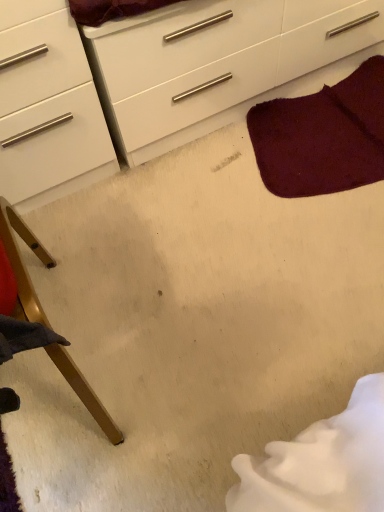
Question: From the image's perspective, would you say wooden chair leg at lower left is shown under white glossy chest of drawers at upper center?

Choices:
 (A) yes
 (B) no

Answer: (A)

Question: Is wooden chair leg at lower left oriented towards white glossy chest of drawers at upper center?

Choices:
 (A) no
 (B) yes

Answer: (A)

Question: Is wooden chair leg at lower left beside white glossy chest of drawers at upper center?

Choices:
 (A) yes
 (B) no

Answer: (B)

Question: Does wooden chair leg at lower left have a lesser width compared to white glossy chest of drawers at upper center?

Choices:
 (A) no
 (B) yes

Answer: (A)

Question: Considering the relative sizes of wooden chair leg at lower left and white glossy chest of drawers at upper center in the image provided, is wooden chair leg at lower left taller than white glossy chest of drawers at upper center?

Choices:
 (A) no
 (B) yes

Answer: (B)

Question: Choose the correct answer: Is white glossy chest of drawers at upper center inside wooden chair leg at lower left or outside it?

Choices:
 (A) outside
 (B) inside

Answer: (A)

Question: Is white glossy chest of drawers at upper center taller or shorter than wooden chair leg at lower left?

Choices:
 (A) tall
 (B) short

Answer: (B)

Question: Is white glossy chest of drawers at upper center wider or thinner than wooden chair leg at lower left?

Choices:
 (A) wide
 (B) thin

Answer: (B)

Question: From the image's perspective, is white glossy chest of drawers at upper center positioned above or below wooden chair leg at lower left?

Choices:
 (A) above
 (B) below

Answer: (A)

Question: In terms of size, does burgundy plush rug at upper right appear bigger or smaller than wooden chair leg at lower left?

Choices:
 (A) small
 (B) big

Answer: (A)

Question: Do you think burgundy plush rug at upper right is within wooden chair leg at lower left, or outside of it?

Choices:
 (A) inside
 (B) outside

Answer: (B)

Question: From a real-world perspective, is burgundy plush rug at upper right above or below wooden chair leg at lower left?

Choices:
 (A) above
 (B) below

Answer: (B)

Question: Is burgundy plush rug at upper right taller or shorter than wooden chair leg at lower left?

Choices:
 (A) tall
 (B) short

Answer: (B)

Question: From their relative heights in the image, would you say white glossy chest of drawers at upper center is taller or shorter than burgundy plush rug at upper right?

Choices:
 (A) tall
 (B) short

Answer: (A)

Question: From a real-world perspective, is white glossy chest of drawers at upper center physically located above or below burgundy plush rug at upper right?

Choices:
 (A) below
 (B) above

Answer: (B)